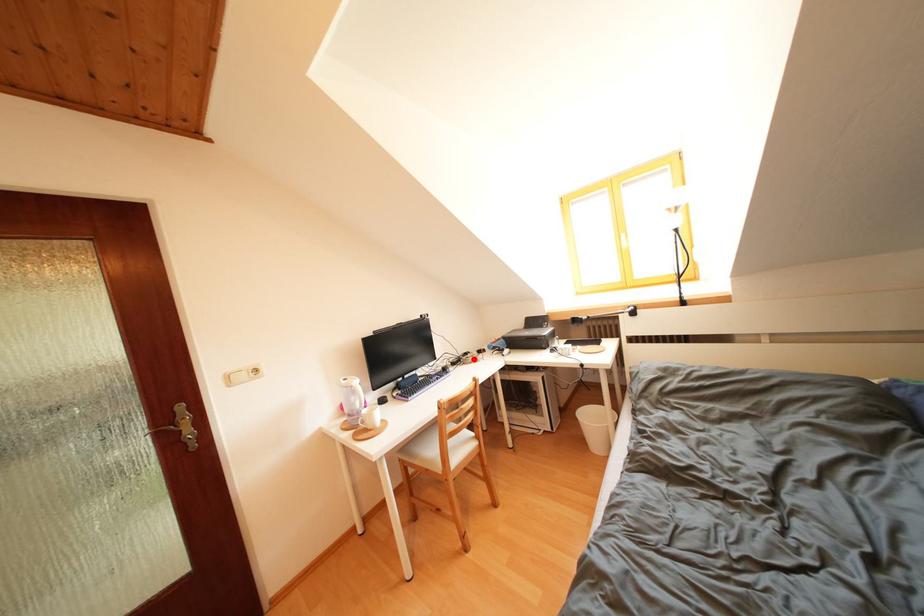
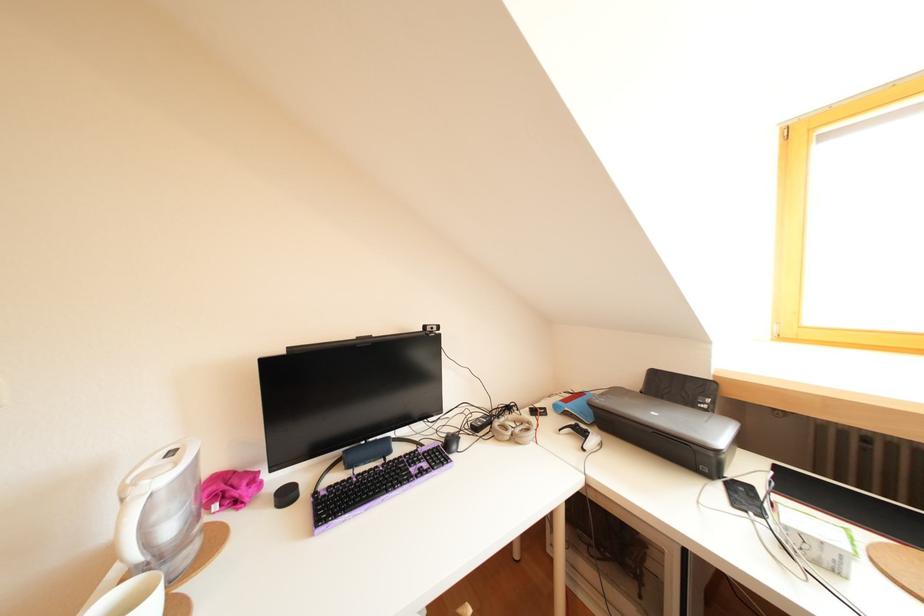
Locate, in the second image, the point that corresponds to the highlighted location in the first image.

(516, 413)